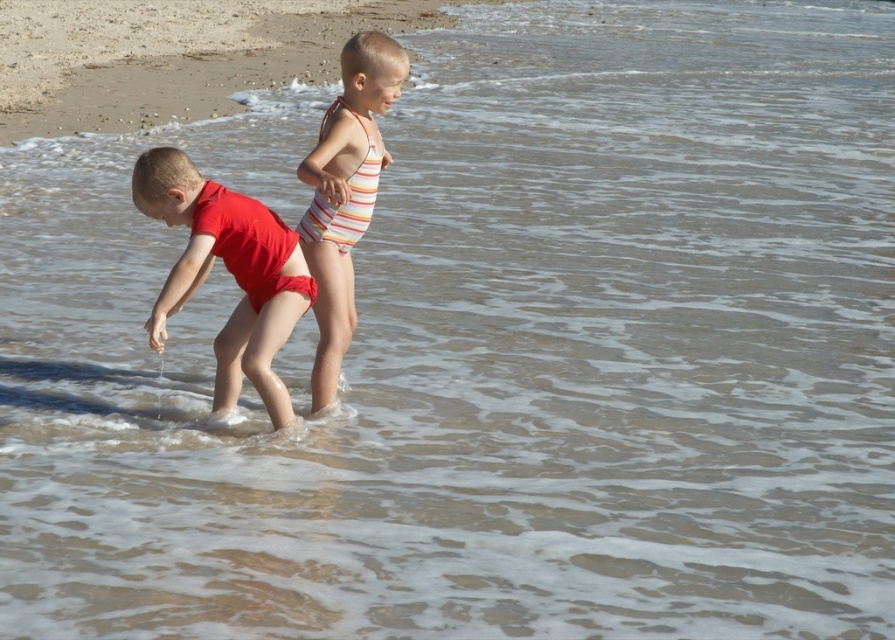
You are a photographer trying to capture a photo of both children. Since the matte red swimsuit at left and the striped fabric swimsuit at center are at different heights, which child should you focus on first to ensure both are in the frame?

The matte red swimsuit at left is located below the striped fabric swimsuit at center, so you should focus on the striped fabric swimsuit at center first to ensure both are in the frame.

You are a lifeguard observing two children at the beach. You notice the matte red swimsuit at left and the striped fabric swimsuit at center. Which child is shorter in height?

The matte red swimsuit at left is shorter in height compared to the striped fabric swimsuit at center, so the child in the matte red swimsuit at left is shorter.